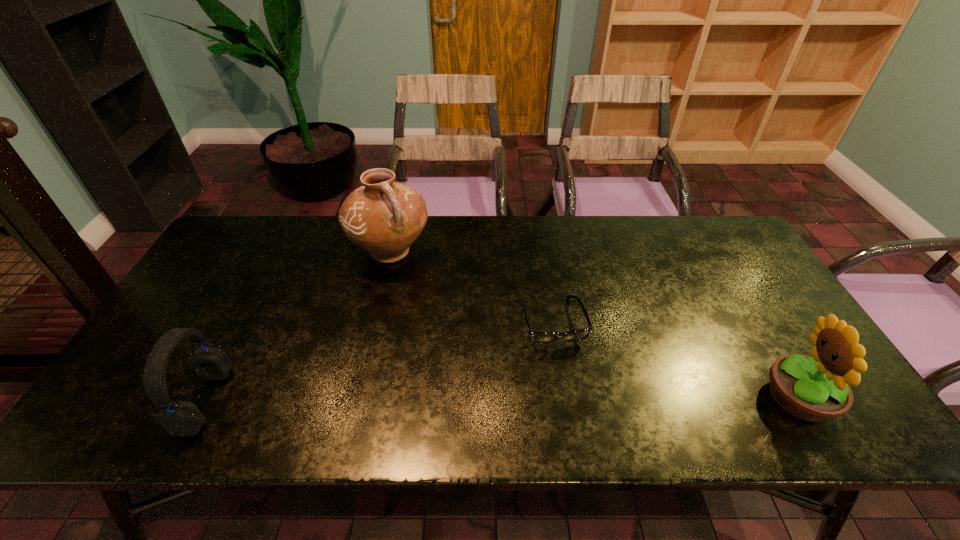
The height and width of the screenshot is (540, 960). What are the coordinates of `vacant area that lies between the second object from right to left and the leftmost object` in the screenshot? It's located at (379, 361).

I want to click on free space between the second object from right to left and the pottery, so click(471, 287).

You are a GUI agent. You are given a task and a screenshot of the screen. Output one action in this format:
    pyautogui.click(x=<x>, y=<y>)
    Task: Click on the free space that is in between the leftmost object and the pottery
    This screenshot has height=540, width=960.
    Given the screenshot: What is the action you would take?
    pyautogui.click(x=298, y=326)

This screenshot has height=540, width=960. Find the location of `free space between the leftmost object and the third object from right to left`. free space between the leftmost object and the third object from right to left is located at coordinates (298, 326).

The image size is (960, 540). What are the coordinates of `object that is the second closest to the rightmost object` in the screenshot? It's located at (383, 217).

The width and height of the screenshot is (960, 540). What are the coordinates of `the third closest object to the pottery` in the screenshot? It's located at (816, 388).

Where is `vacant space that satisfies the following two spatial constraints: 1. on the front side of the second object from left to right; 2. on the face of the sunflower`? vacant space that satisfies the following two spatial constraints: 1. on the front side of the second object from left to right; 2. on the face of the sunflower is located at coordinates (356, 397).